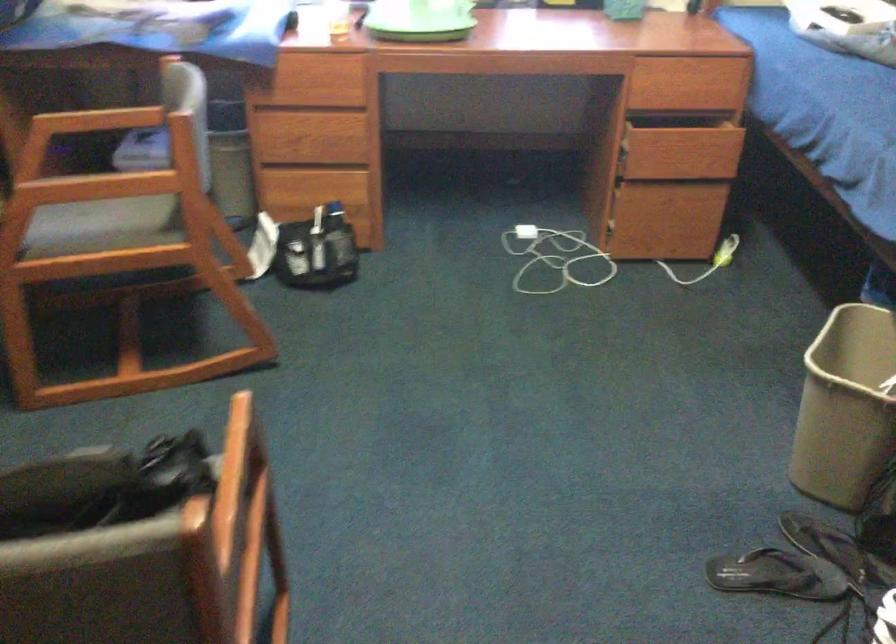
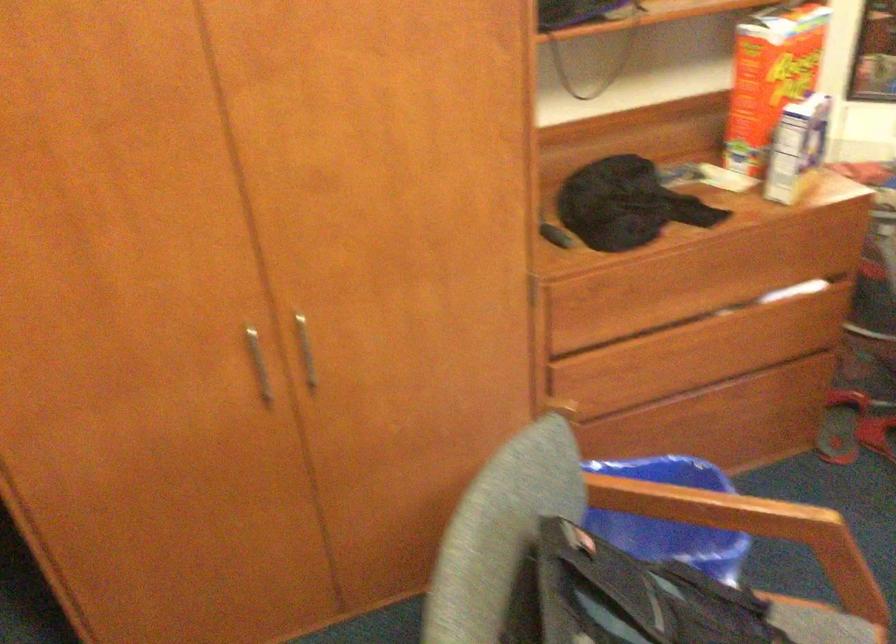
The images are taken continuously from a first-person perspective. In which direction is your viewpoint rotating?

The rotation direction of the camera is left-down.